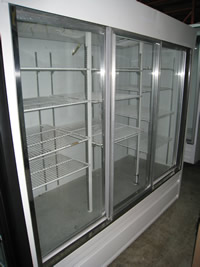
At what (x,y) coordinates should I click in order to perform the action: click on concrete floor. Please return your answer as a coordinate pair (x, y). This screenshot has height=267, width=200. Looking at the image, I should click on (177, 235).